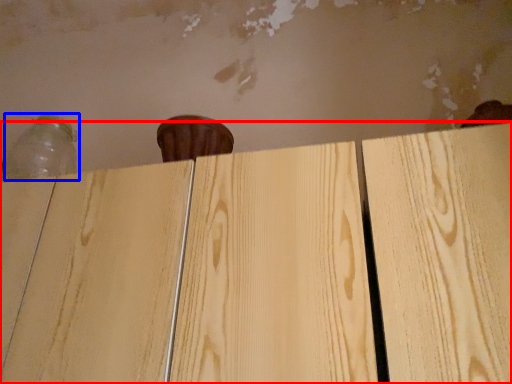
Question: Among these objects, which one is nearest to the camera, plywood (highlighted by a red box) or bottle (highlighted by a blue box)?

Choices:
 (A) plywood
 (B) bottle

Answer: (A)